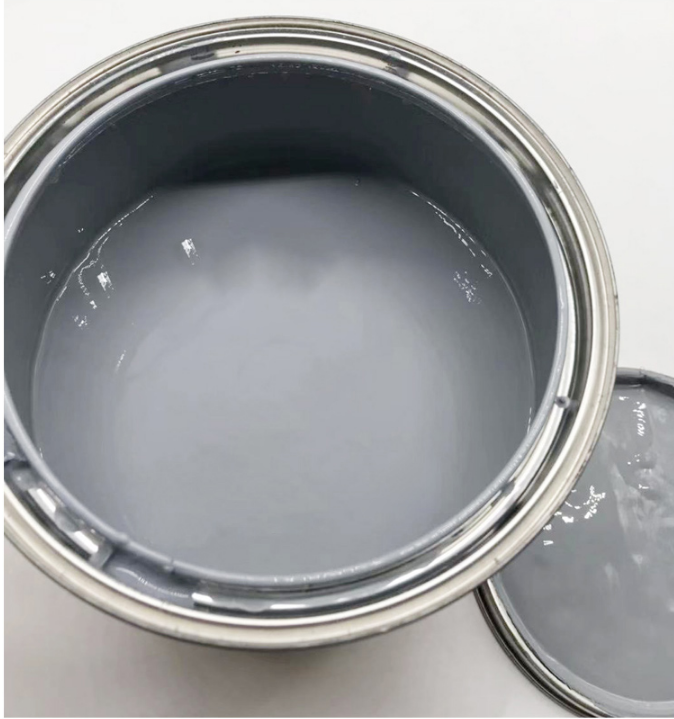
Where is `gray paint`? The height and width of the screenshot is (719, 674). gray paint is located at coordinates (335, 523).